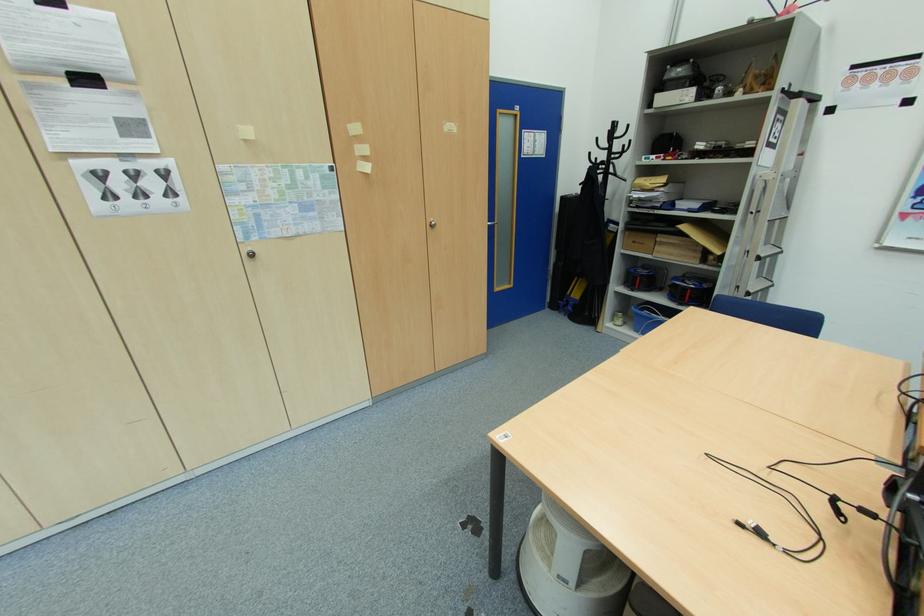
At what (x,y) coordinates should I click in order to perform the action: click on chair sitting surface. Please return your answer as a coordinate pair (x, y). Image resolution: width=924 pixels, height=616 pixels. Looking at the image, I should click on (770, 314).